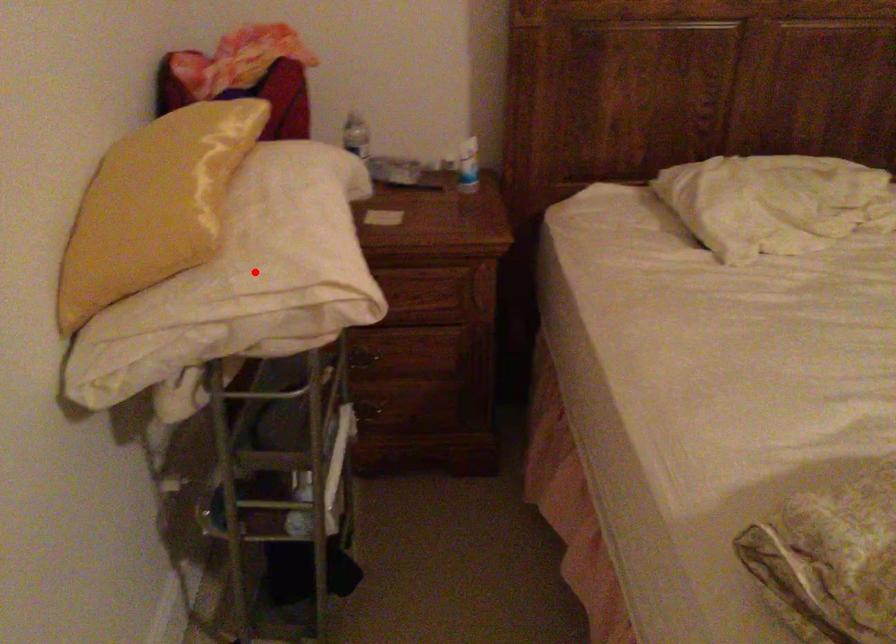
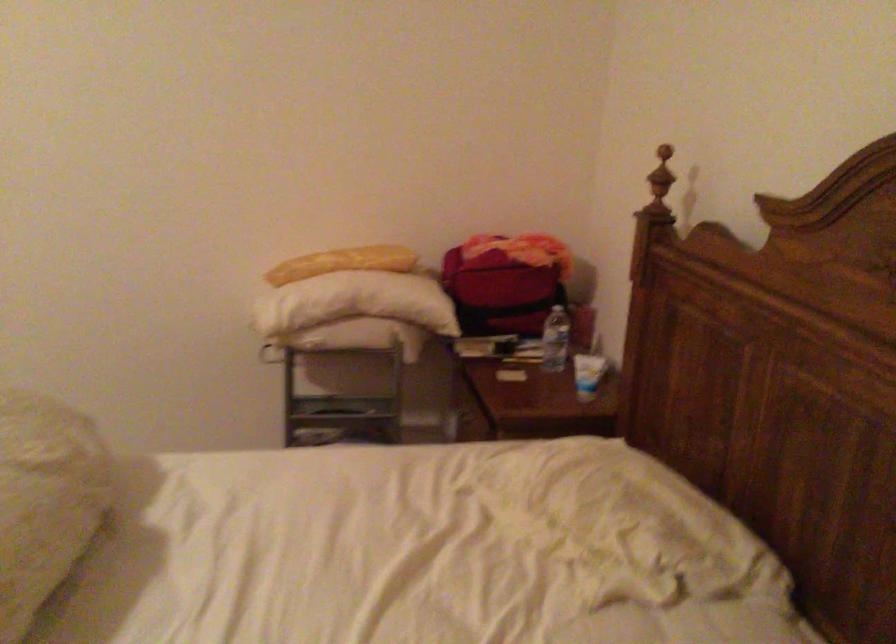
Question: I am providing you with two images of the same scene from different viewpoints. A red point is marked on the first image. Is the red point's position out of view in image 2?

Choices:
 (A) Yes
 (B) No

Answer: (A)